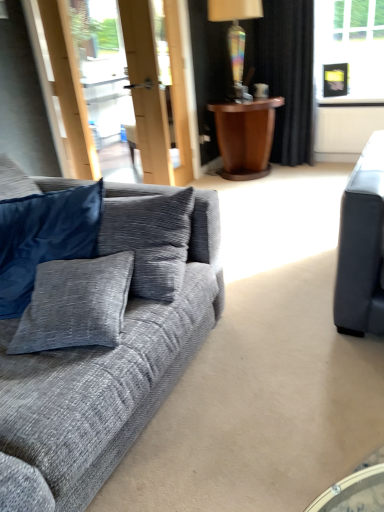
Question: Is rainbow glass lamp at upper center behind textured gray couch at left?

Choices:
 (A) no
 (B) yes

Answer: (B)

Question: Considering the relative sizes of rainbow glass lamp at upper center and textured gray couch at left in the image provided, is rainbow glass lamp at upper center thinner than textured gray couch at left?

Choices:
 (A) yes
 (B) no

Answer: (A)

Question: Is rainbow glass lamp at upper center oriented towards textured gray couch at left?

Choices:
 (A) yes
 (B) no

Answer: (B)

Question: Considering the relative sizes of rainbow glass lamp at upper center and textured gray couch at left in the image provided, is rainbow glass lamp at upper center shorter than textured gray couch at left?

Choices:
 (A) no
 (B) yes

Answer: (B)

Question: Is rainbow glass lamp at upper center at the right side of textured gray couch at left?

Choices:
 (A) no
 (B) yes

Answer: (B)

Question: Is rainbow glass lamp at upper center smaller than textured gray couch at left?

Choices:
 (A) no
 (B) yes

Answer: (B)

Question: Considering the relative positions of black velvet curtain at upper right and textured gray couch at left in the image provided, is black velvet curtain at upper right in front of textured gray couch at left?

Choices:
 (A) yes
 (B) no

Answer: (B)

Question: Is black velvet curtain at upper right positioned behind textured gray couch at left?

Choices:
 (A) yes
 (B) no

Answer: (A)

Question: Considering the relative sizes of black velvet curtain at upper right and textured gray couch at left in the image provided, is black velvet curtain at upper right smaller than textured gray couch at left?

Choices:
 (A) yes
 (B) no

Answer: (A)

Question: Is black velvet curtain at upper right turned away from textured gray couch at left?

Choices:
 (A) no
 (B) yes

Answer: (A)

Question: Considering the relative positions of black velvet curtain at upper right and textured gray couch at left in the image provided, is black velvet curtain at upper right to the left of textured gray couch at left from the viewer's perspective?

Choices:
 (A) no
 (B) yes

Answer: (A)

Question: Can you confirm if black velvet curtain at upper right is thinner than textured gray couch at left?

Choices:
 (A) yes
 (B) no

Answer: (A)

Question: Is the surface of textured gray couch at left in direct contact with rainbow glass lamp at upper center?

Choices:
 (A) no
 (B) yes

Answer: (A)